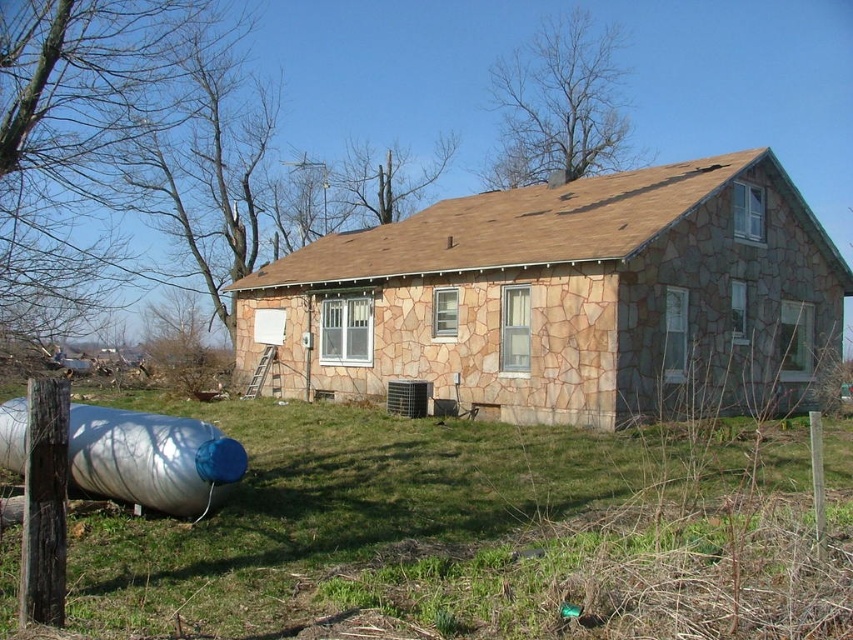
Question: Does green grass at lower center appear on the left side of stone textured house at center?

Choices:
 (A) no
 (B) yes

Answer: (A)

Question: Observing the image, what is the correct spatial positioning of green grass at lower center in reference to stone textured house at center?

Choices:
 (A) below
 (B) above

Answer: (A)

Question: Can you confirm if green grass at lower center is positioned above stone textured house at center?

Choices:
 (A) no
 (B) yes

Answer: (A)